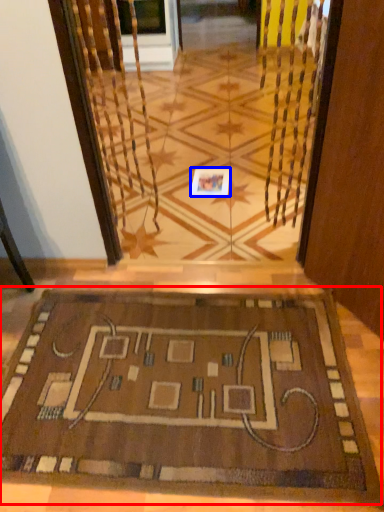
Question: Which object is further to the camera taking this photo, mat (highlighted by a red box) or square (highlighted by a blue box)?

Choices:
 (A) mat
 (B) square

Answer: (B)